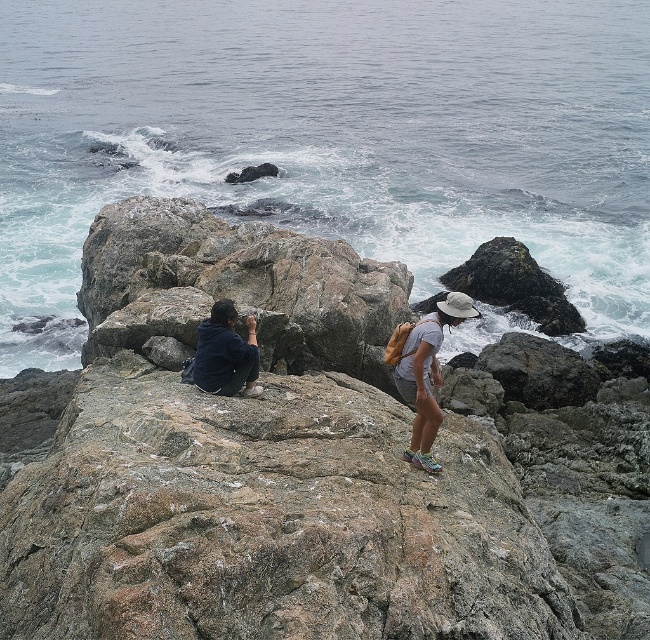
You are a photographer trying to capture the scene with your camera. The white frothy water at upper center and the dark blue jacket at center are both in your viewfinder. Which object takes up more space in the frame?

The white frothy water at upper center takes up more space in the frame because it is bigger than the dark blue jacket at center.

You are standing on the rocky terrain in the coastal scene. There is a rough textured rock at center marked by point (266, 518). If you want to move from the seated person on the left to the standing person on the right, should you walk around the rough textured rock at center to the north or south?

The rough textured rock at center is located between the seated person on the left and the standing person on the right. To move from the seated person on the left to the standing person on the right, you should walk around the rough textured rock at center either to the north or south, as the rock itself is in the direct path between them.